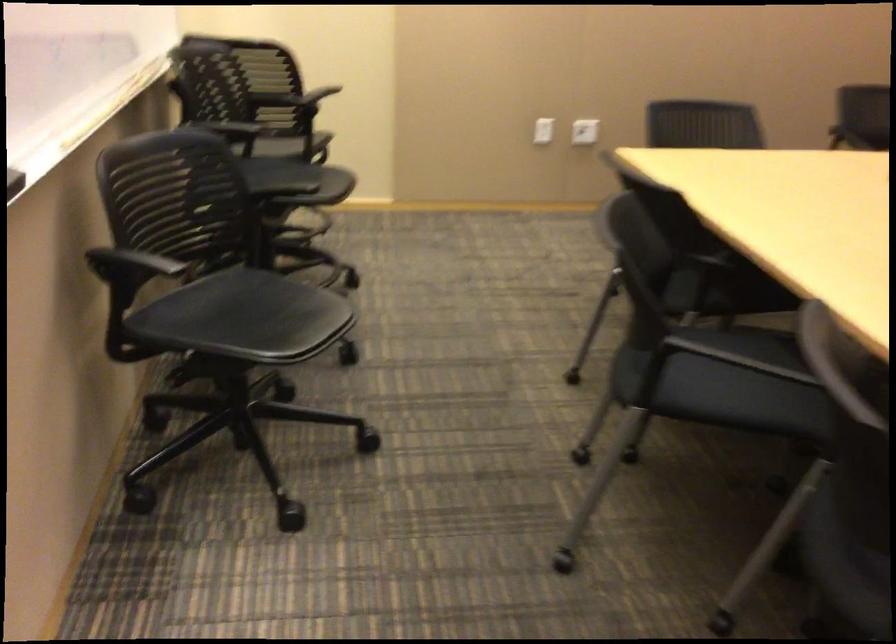
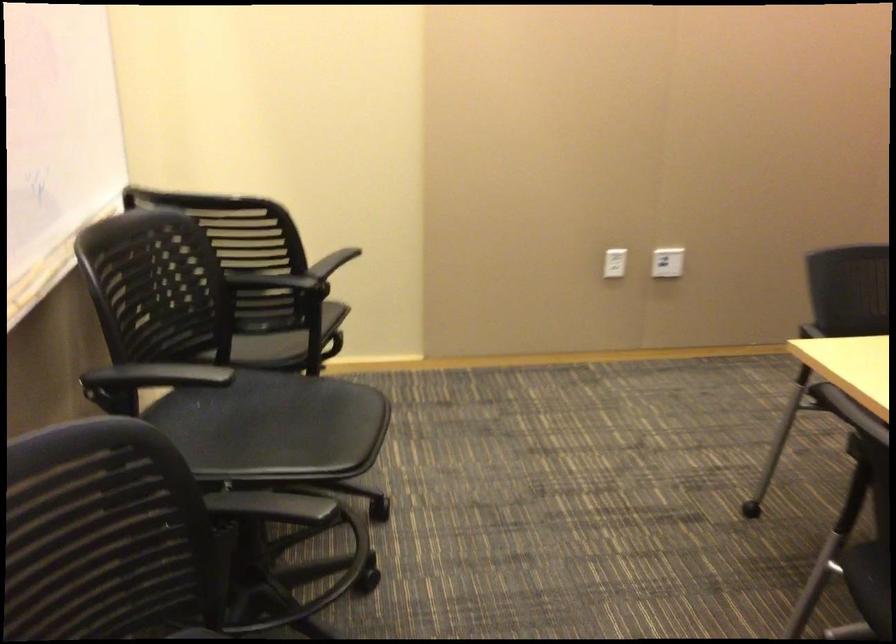
Find the pixel in the second image that matches [544,128] in the first image.

(615, 263)